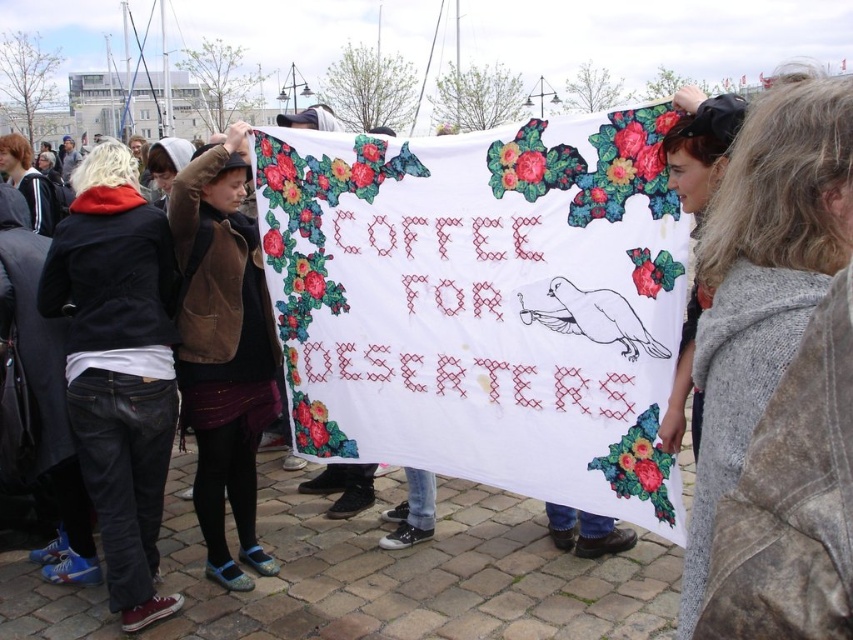
Is brown suede jacket at center to the left of matte black jacket at left from the viewer's perspective?

No, brown suede jacket at center is not to the left of matte black jacket at left.

Between brown suede jacket at center and matte black jacket at left, which one appears on the left side from the viewer's perspective?

matte black jacket at left is more to the left.

At what (x,y) coordinates should I click in order to perform the action: click on brown suede jacket at center. Please return your answer as a coordinate pair (x, y). Looking at the image, I should click on (223, 349).

Is gray knit sweater at center thinner than matte black jacket at left?

Indeed, gray knit sweater at center has a lesser width compared to matte black jacket at left.

Is gray knit sweater at center to the left of matte black jacket at left from the viewer's perspective?

No, gray knit sweater at center is not to the left of matte black jacket at left.

Between point (842, 186) and point (36, 170), which one is positioned behind?

Point (36, 170)

Identify the location of gray knit sweater at center. (762, 280).

Who is more forward, (781, 307) or (242, 484)?

Positioned in front is point (781, 307).

Is gray knit sweater at center positioned in front of brown suede jacket at center?

Yes, gray knit sweater at center is closer to the viewer.

Is point (791, 353) closer to camera compared to point (186, 422)?

Yes, point (791, 353) is in front of point (186, 422).

Where is `gray knit sweater at center`? gray knit sweater at center is located at coordinates (762, 280).